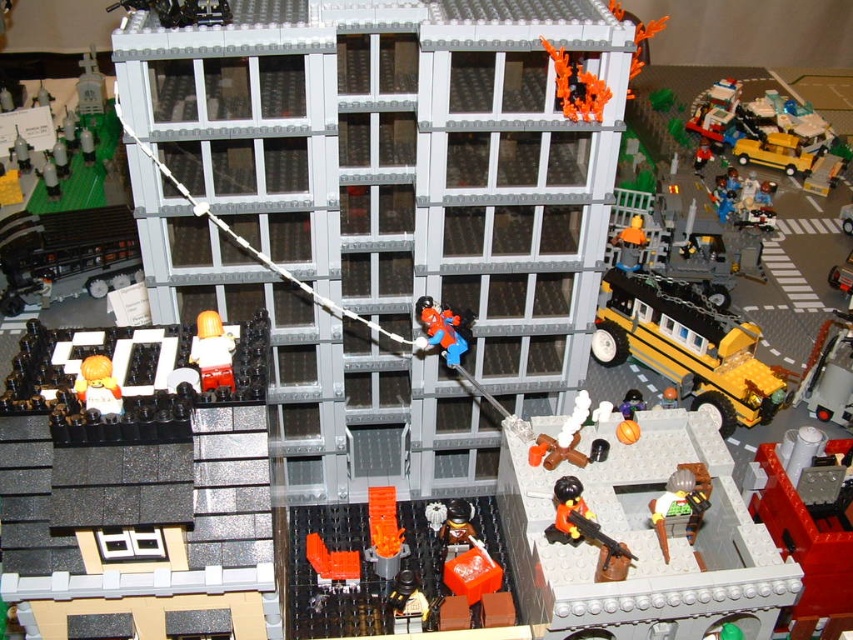
Question: Is matte orange minifigure at lower left to the right of smooth black figure at center from the viewer's perspective?

Choices:
 (A) yes
 (B) no

Answer: (B)

Question: Is matte black car at left further to camera compared to orange matte staircase at lower center?

Choices:
 (A) no
 (B) yes

Answer: (B)

Question: Does yellow matte school bus at center-right have a lesser width compared to orange matte construction worker at upper right?

Choices:
 (A) yes
 (B) no

Answer: (B)

Question: Which object is the closest to the orange matte staircase at lower center?

Choices:
 (A) orange matte construction worker at upper right
 (B) wooden toy gun at center
 (C) matte orange minifigure at lower left
 (D) matte black car at left

Answer: (B)

Question: Which object is closer to the camera taking this photo?

Choices:
 (A) orange matte figure at center
 (B) matte orange minifigure at lower left

Answer: (B)

Question: Among these points, which one is nearest to the camera?

Choices:
 (A) (225, 483)
 (B) (621, 269)

Answer: (A)